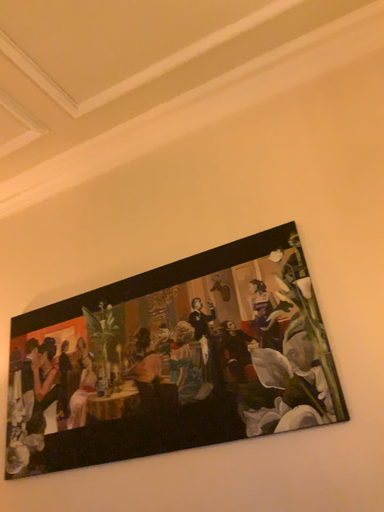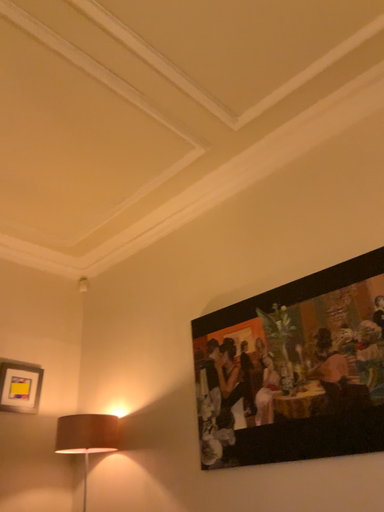
Question: Which way did the camera rotate in the video?

Choices:
 (A) rotated right
 (B) rotated left

Answer: (B)